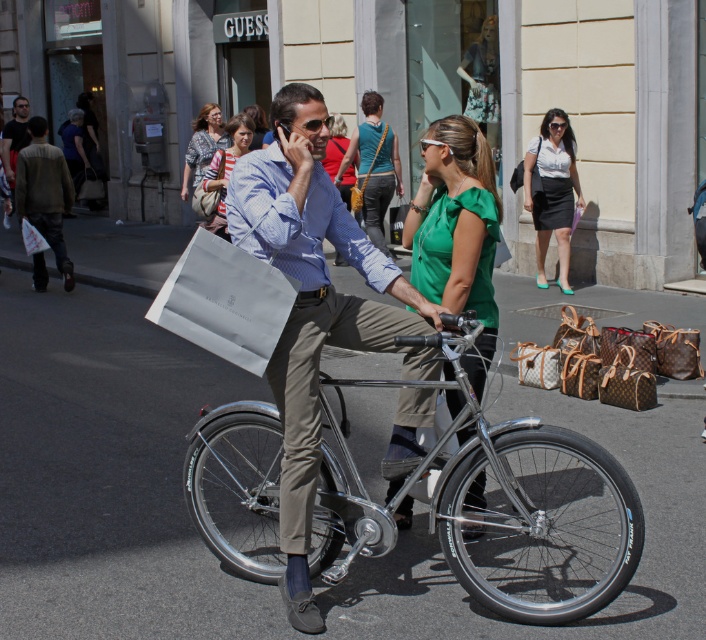
Question: Considering the relative positions of green fabric blouse at center and matte white bag at center in the image provided, where is green fabric blouse at center located with respect to matte white bag at center?

Choices:
 (A) below
 (B) above

Answer: (A)

Question: Does matte blue shirt at center appear on the right side of matte white blouse at upper center?

Choices:
 (A) no
 (B) yes

Answer: (A)

Question: Among these objects, which one is farthest from the camera?

Choices:
 (A) matte white blouse at upper center
 (B) matte white bag at left
 (C) shiny metallic bicycle at center
 (D) patterned fabric handbag at upper left

Answer: (B)

Question: Is dark gray sweater at left further to the viewer compared to matte white bag at left?

Choices:
 (A) no
 (B) yes

Answer: (A)

Question: Which point appears closest to the camera in this image?

Choices:
 (A) (489, 209)
 (B) (256, 129)
 (C) (241, 132)

Answer: (A)

Question: Which of the following is the farthest from the observer?

Choices:
 (A) (542, 262)
 (B) (556, 486)
 (C) (258, 116)
 (D) (378, 216)

Answer: (C)